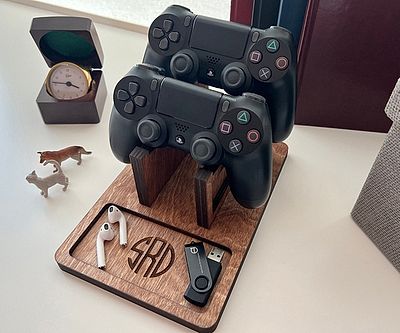
Find the location of a particular element. brown dog ornament is located at coordinates (67, 154).